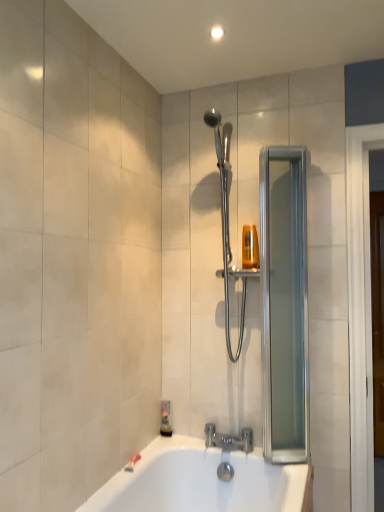
This screenshot has width=384, height=512. I want to click on translucent plastic soap dispenser at lower left, so click(x=165, y=419).

Find the location of a particular element. The width and height of the screenshot is (384, 512). translucent plastic soap dispenser at lower left is located at coordinates (165, 419).

Looking at their sizes, would you say polished chrome shower at center is wider or thinner than clear glass screen door at right?

In the image, polished chrome shower at center appears to be wider than clear glass screen door at right.

Where is `screen door that appears below the polished chrome shower at center (from a real-world perspective)`? screen door that appears below the polished chrome shower at center (from a real-world perspective) is located at coordinates (284, 304).

From the image's perspective, would you say polished chrome shower at center is shown under clear glass screen door at right?

Actually, polished chrome shower at center appears above clear glass screen door at right in the image.

Is clear glass screen door at right bigger than silver metallic faucet at lower center?

Correct, clear glass screen door at right is larger in size than silver metallic faucet at lower center.

This screenshot has height=512, width=384. I want to click on tap below the clear glass screen door at right (from the image's perspective), so click(x=229, y=439).

Which is in front, point (306, 283) or point (210, 425)?

The point (306, 283) is closer.

Who is more distant, clear glass screen door at right or silver metallic faucet at lower center?

silver metallic faucet at lower center.

Considering the positions of points (227, 320) and (164, 400), is point (227, 320) farther from camera compared to point (164, 400)?

No, it is not.

From the image's perspective, which one is positioned lower, polished chrome shower at center or translucent plastic soap dispenser at lower left?

From the image's view, translucent plastic soap dispenser at lower left is below.

Locate an element on the screen. This screenshot has height=512, width=384. shower in front of the translucent plastic soap dispenser at lower left is located at coordinates (227, 223).

Is translucent plastic soap dispenser at lower left far away from silver metallic faucet at lower center?

They are positioned close to each other.

Which is more to the right, translucent plastic soap dispenser at lower left or silver metallic faucet at lower center?

silver metallic faucet at lower center.

From the image's perspective, between translucent plastic soap dispenser at lower left and silver metallic faucet at lower center, who is located below?

silver metallic faucet at lower center.

Is silver metallic faucet at lower center a part of translucent plastic soap dispenser at lower left?

No, silver metallic faucet at lower center is not inside translucent plastic soap dispenser at lower left.

Who is more distant, clear glass screen door at right or polished chrome shower at center?

polished chrome shower at center is behind.

Is clear glass screen door at right taller than polished chrome shower at center?

Indeed, clear glass screen door at right has a greater height compared to polished chrome shower at center.

Based on the photo, who is smaller, clear glass screen door at right or polished chrome shower at center?

clear glass screen door at right.

From the picture: From a real-world perspective, is clear glass screen door at right physically located above or below polished chrome shower at center?

clear glass screen door at right is situated lower than polished chrome shower at center in the real world.

Which is in front, point (206, 446) or point (283, 146)?

The point (283, 146) is closer to the camera.

Is clear glass screen door at right completely or partially inside silver metallic faucet at lower center?

No, clear glass screen door at right is not inside silver metallic faucet at lower center.

Between silver metallic faucet at lower center and clear glass screen door at right, which one is positioned in front?

clear glass screen door at right is closer to the camera.

Between silver metallic faucet at lower center and translucent plastic soap dispenser at lower left, which one has larger size?

Bigger between the two is silver metallic faucet at lower center.

Looking at this image, choose the correct answer: Is silver metallic faucet at lower center inside translucent plastic soap dispenser at lower left or outside it?

silver metallic faucet at lower center is not inside translucent plastic soap dispenser at lower left, it's outside.

Would you say silver metallic faucet at lower center is a long distance from translucent plastic soap dispenser at lower left?

silver metallic faucet at lower center is near translucent plastic soap dispenser at lower left, not far away.

The height and width of the screenshot is (512, 384). Find the location of `screen door located underneath the polished chrome shower at center (from a real-world perspective)`. screen door located underneath the polished chrome shower at center (from a real-world perspective) is located at coordinates (284, 304).

The width and height of the screenshot is (384, 512). Identify the location of screen door in front of the silver metallic faucet at lower center. (284, 304).

Estimate the real-world distances between objects in this image. Which object is further from clear glass screen door at right, translucent plastic soap dispenser at lower left or polished chrome shower at center?

Based on the image, translucent plastic soap dispenser at lower left appears to be further to clear glass screen door at right.

Estimate the real-world distances between objects in this image. Which object is further from translucent plastic soap dispenser at lower left, polished chrome shower at center or clear glass screen door at right?

clear glass screen door at right is further to translucent plastic soap dispenser at lower left.

When comparing their distances from clear glass screen door at right, does polished chrome shower at center or silver metallic faucet at lower center seem closer?

polished chrome shower at center is positioned closer to the anchor clear glass screen door at right.

From the image, which object appears to be farther from polished chrome shower at center, clear glass screen door at right or translucent plastic soap dispenser at lower left?

The object further to polished chrome shower at center is translucent plastic soap dispenser at lower left.

Estimate the real-world distances between objects in this image. Which object is further from clear glass screen door at right, silver metallic faucet at lower center or translucent plastic soap dispenser at lower left?

The object further to clear glass screen door at right is translucent plastic soap dispenser at lower left.

From the image, which object appears to be nearer to polished chrome shower at center, translucent plastic soap dispenser at lower left or silver metallic faucet at lower center?

The object closer to polished chrome shower at center is silver metallic faucet at lower center.

When comparing their distances from translucent plastic soap dispenser at lower left, does clear glass screen door at right or polished chrome shower at center seem further?

clear glass screen door at right.

Based on their spatial positions, is translucent plastic soap dispenser at lower left or polished chrome shower at center further from silver metallic faucet at lower center?

Based on the image, polished chrome shower at center appears to be further to silver metallic faucet at lower center.

This screenshot has width=384, height=512. I want to click on screen door between polished chrome shower at center and translucent plastic soap dispenser at lower left from top to bottom, so click(x=284, y=304).

Where is `screen door between polished chrome shower at center and silver metallic faucet at lower center from top to bottom`? The height and width of the screenshot is (512, 384). screen door between polished chrome shower at center and silver metallic faucet at lower center from top to bottom is located at coordinates (284, 304).

Locate an element on the screen. soap dispenser between clear glass screen door at right and silver metallic faucet at lower center vertically is located at coordinates (165, 419).

The height and width of the screenshot is (512, 384). I want to click on soap dispenser between polished chrome shower at center and silver metallic faucet at lower center vertically, so click(165, 419).